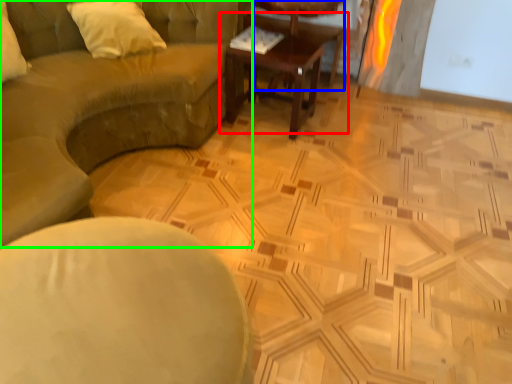
Question: Which object is positioned farthest from coffee table (highlighted by a red box)? Select from cocktail table (highlighted by a blue box) and studio couch (highlighted by a green box).

Choices:
 (A) cocktail table
 (B) studio couch

Answer: (B)